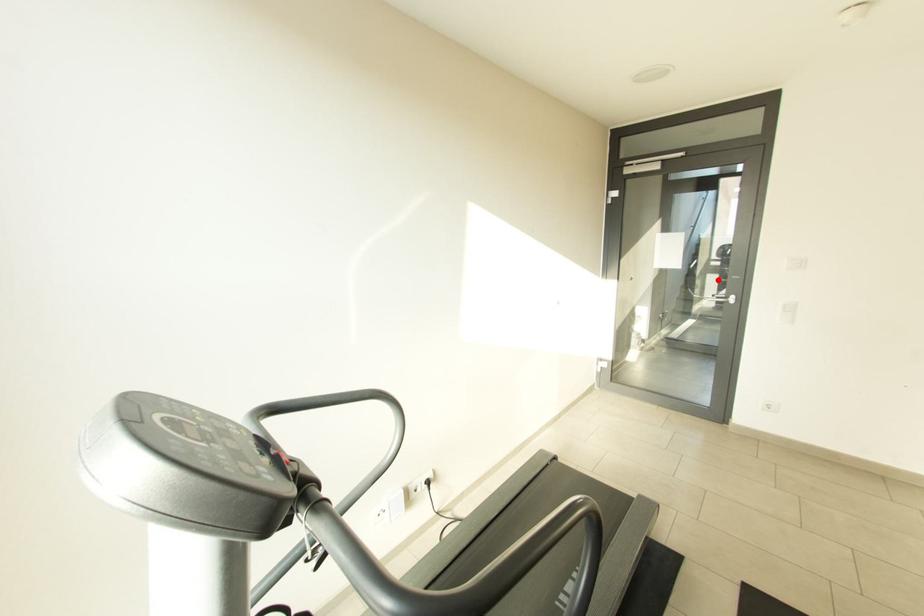
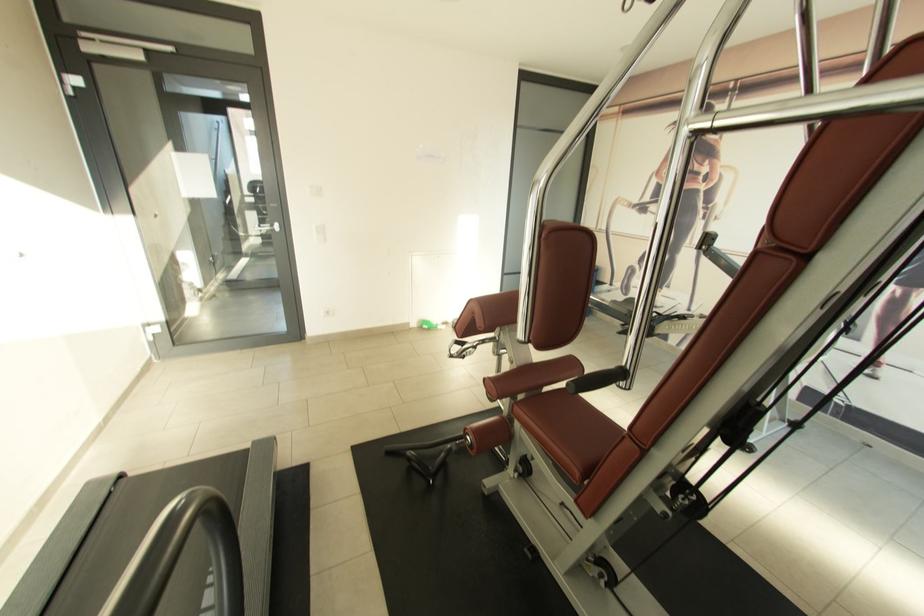
Find the pixel in the second image that matches the highlighted location in the first image.

(257, 217)